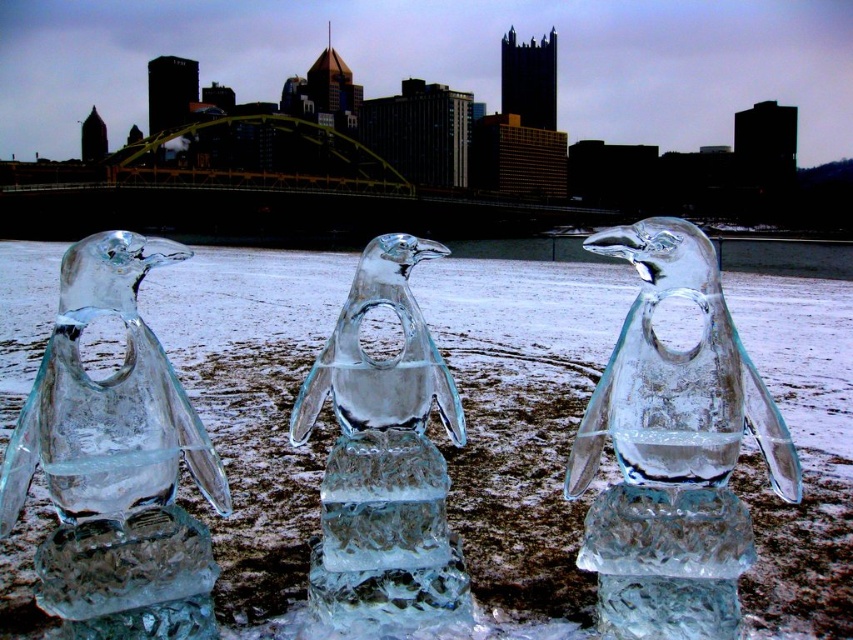
You are a photographer trying to capture a photo of the transparent ice sculpture at center and the transparent ice penguin at left. If you want to ensure both are fully visible in your shot without any part being cut off, which one should you focus on first?

The transparent ice sculpture at center is taller than the transparent ice penguin at left, so you should focus on the transparent ice sculpture at center first to ensure its full height is captured in the frame.

You are a delivery drone with a 0.8 meters wingspan. You need to fly between the two points marked as point (326,376) and point 0.689, 0.483. Can you safely pass through the space between them?

The distance between the two points marked as point (326,376) and point 0.689, 0.483 is 1.03 meters. Since your drone has a wingspan of 0.8 meters, there is enough space for it to pass safely between them.